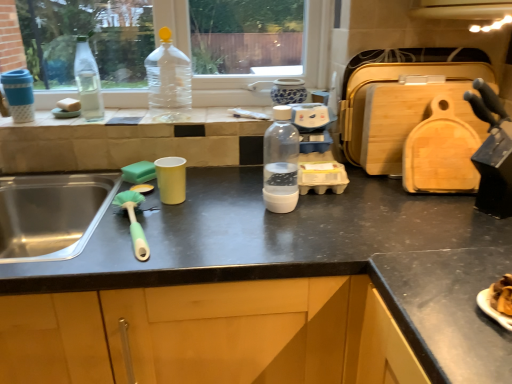
You are a GUI agent. You are given a task and a screenshot of the screen. Output one action in this format:
    pyautogui.click(x=<x>, y=<y>)
    Task: Click on the vacant area that is situated to the right of green plastic brush at left
    
    Given the screenshot: What is the action you would take?
    pyautogui.click(x=200, y=230)